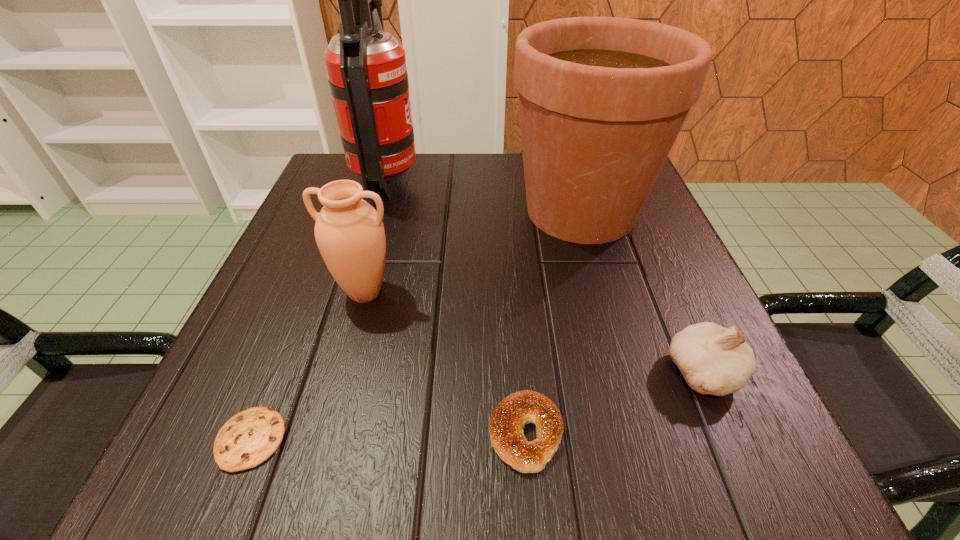
Identify the location of vacant region that satisfies the following two spatial constraints: 1. on the front label side of the tallest object; 2. on the right side of the urn. (353, 293).